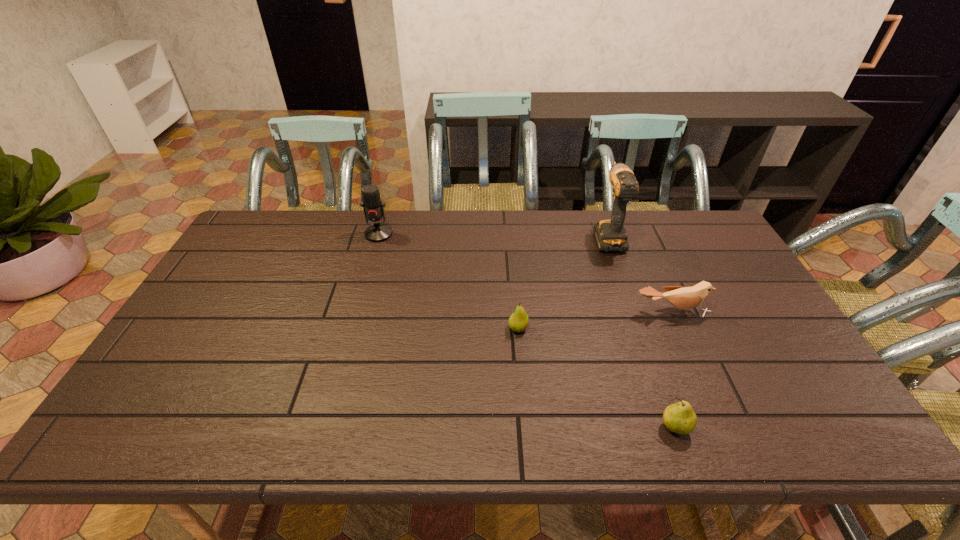
Where is `drill`? drill is located at coordinates (610, 235).

Where is `microphone`? The image size is (960, 540). microphone is located at coordinates (373, 207).

In order to click on the leftmost object in this screenshot , I will do `click(373, 207)`.

This screenshot has height=540, width=960. I want to click on bird, so click(683, 298).

Locate an element on the screen. This screenshot has height=540, width=960. the farther pear is located at coordinates (518, 321).

Where is `the left pear`? the left pear is located at coordinates (518, 321).

Locate an element on the screen. The width and height of the screenshot is (960, 540). the nearest object is located at coordinates (680, 418).

I want to click on the nearer pear, so click(x=680, y=418).

Where is `vacant space located on the side of the microphone with the red ring`? The height and width of the screenshot is (540, 960). vacant space located on the side of the microphone with the red ring is located at coordinates (369, 269).

The height and width of the screenshot is (540, 960). I want to click on free spot located 0.210m at the beak of the third nearest object, so click(x=704, y=385).